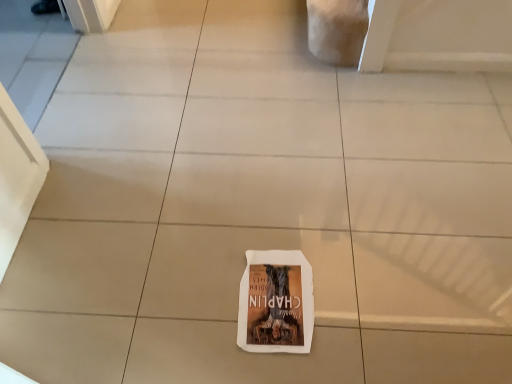
Where is `empty space that is ontop of white paper flyer at center (from a real-world perspective)`? empty space that is ontop of white paper flyer at center (from a real-world perspective) is located at coordinates (272, 293).